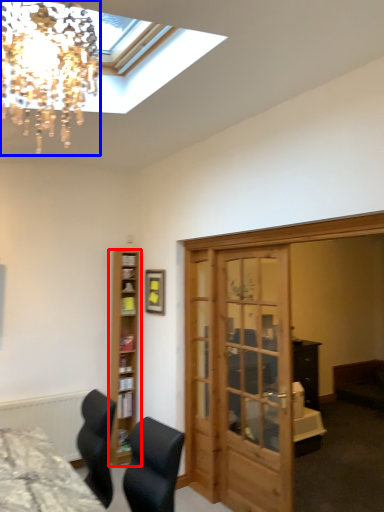
Question: Which object is further to the camera taking this photo, shelf (highlighted by a red box) or lamp (highlighted by a blue box)?

Choices:
 (A) shelf
 (B) lamp

Answer: (A)